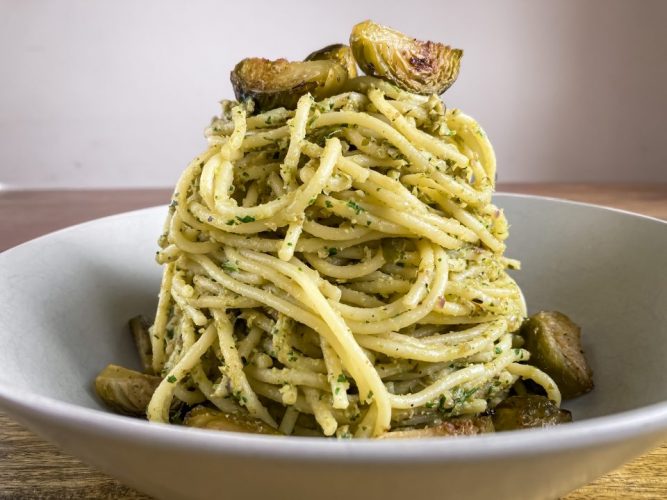
Image resolution: width=667 pixels, height=500 pixels. Find the location of `table`. table is located at coordinates (55, 476).